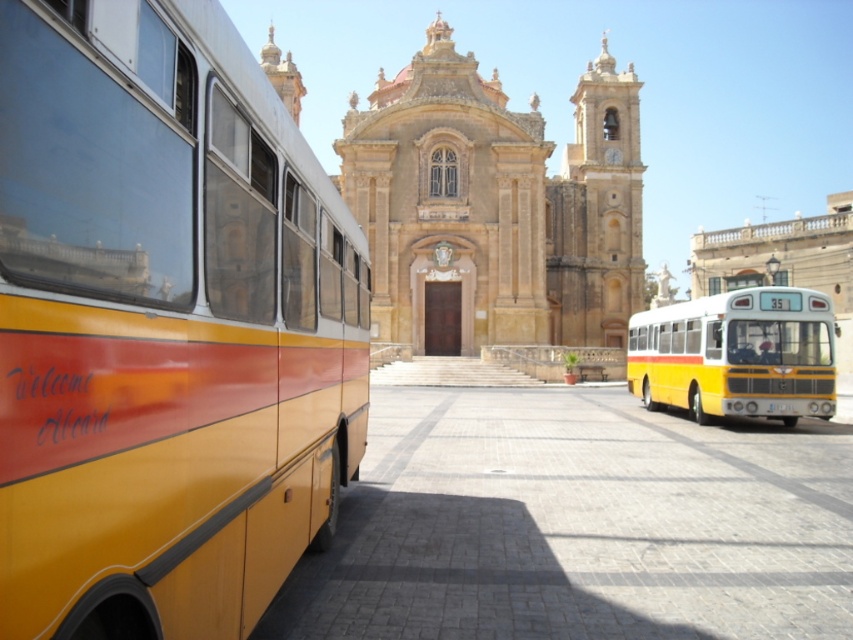
Question: Which point is farther to the camera?

Choices:
 (A) yellow matte bus at left
 (B) yellow matte bus at center
 (C) golden stone cathedral at center

Answer: (C)

Question: Does yellow matte bus at left have a larger size compared to yellow matte bus at center?

Choices:
 (A) yes
 (B) no

Answer: (B)

Question: Can you confirm if yellow matte bus at left is positioned above golden stone cathedral at center?

Choices:
 (A) no
 (B) yes

Answer: (A)

Question: Among these points, which one is nearest to the camera?

Choices:
 (A) (637, 358)
 (B) (549, 188)

Answer: (A)

Question: Which object is the closest to the yellow matte bus at left?

Choices:
 (A) golden stone cathedral at center
 (B) yellow matte bus at center

Answer: (B)

Question: Observing the image, what is the correct spatial positioning of yellow matte bus at left in reference to yellow matte bus at center?

Choices:
 (A) below
 (B) above

Answer: (B)